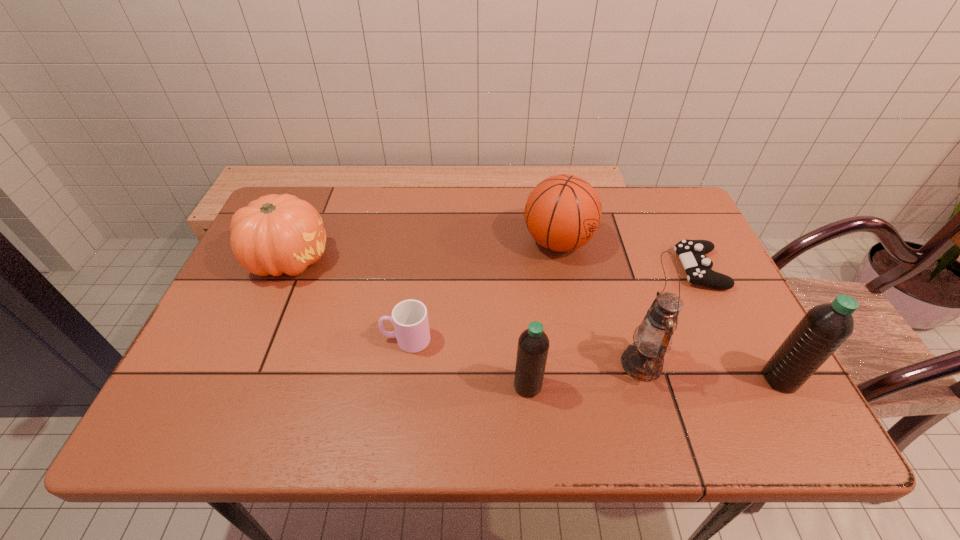
Where is `free spot at the left edge of the desktop`? This screenshot has width=960, height=540. free spot at the left edge of the desktop is located at coordinates (267, 309).

In the image, there is a desktop. Find the location of `vacant space at the right edge`. vacant space at the right edge is located at coordinates (718, 341).

This screenshot has height=540, width=960. I want to click on vacant area at the near right corner, so click(766, 360).

This screenshot has height=540, width=960. In order to click on free space between the oil lamp and the second tallest object in this screenshot , I will do `click(710, 372)`.

I want to click on vacant area that lies between the right water bottle and the pumpkin, so click(x=535, y=319).

The image size is (960, 540). I want to click on free spot between the sixth object from right to left and the basketball, so click(482, 291).

Locate an element on the screen. vacant space in between the basketball and the pumpkin is located at coordinates click(x=423, y=251).

Where is `blank region between the sixth tallest object and the control`? blank region between the sixth tallest object and the control is located at coordinates (553, 305).

You are a GUI agent. You are given a task and a screenshot of the screen. Output one action in this format:
    pyautogui.click(x=<x>, y=<y>)
    Task: Click on the vacant space that is in between the second object from left to right and the pumpkin
    The image size is (960, 540).
    Given the screenshot: What is the action you would take?
    pyautogui.click(x=348, y=299)

The image size is (960, 540). What are the coordinates of `empty space that is in between the oil lamp and the shorter water bottle` in the screenshot? It's located at (585, 375).